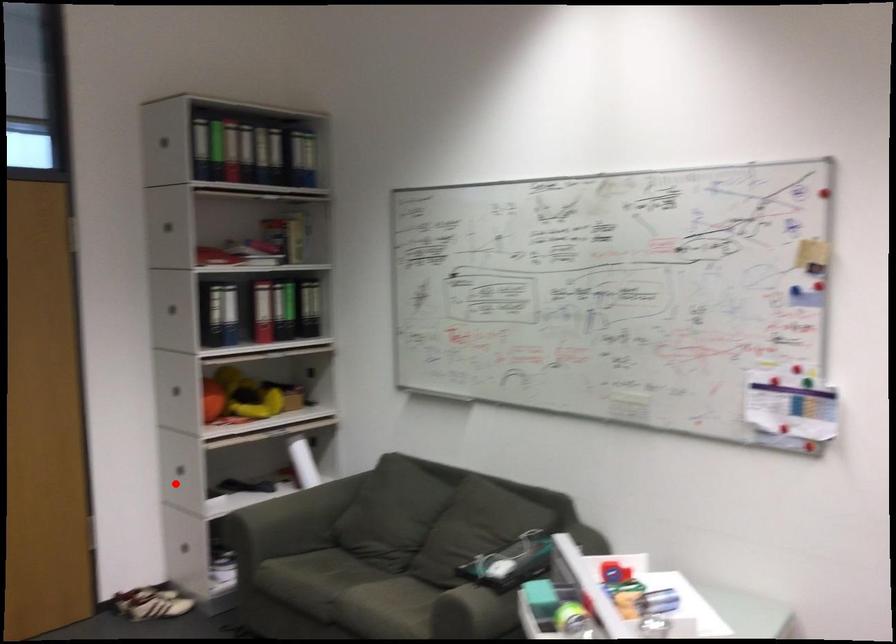
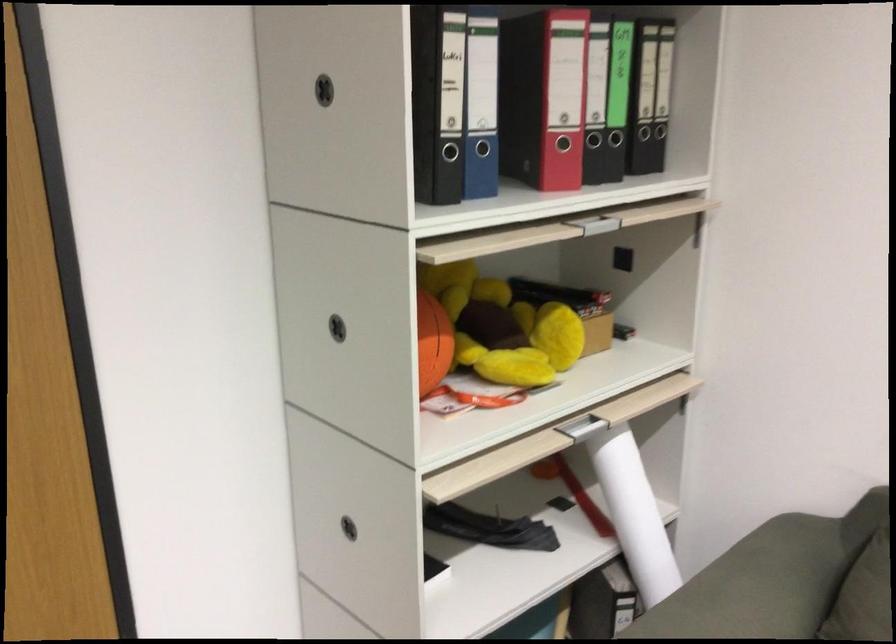
Question: I am providing you with two images of the same scene from different viewpoints. In image1, a red point is highlighted. Considering the same 3D point in image2, which of the following is correct?

Choices:
 (A) It is closer
 (B) It is farther

Answer: (A)